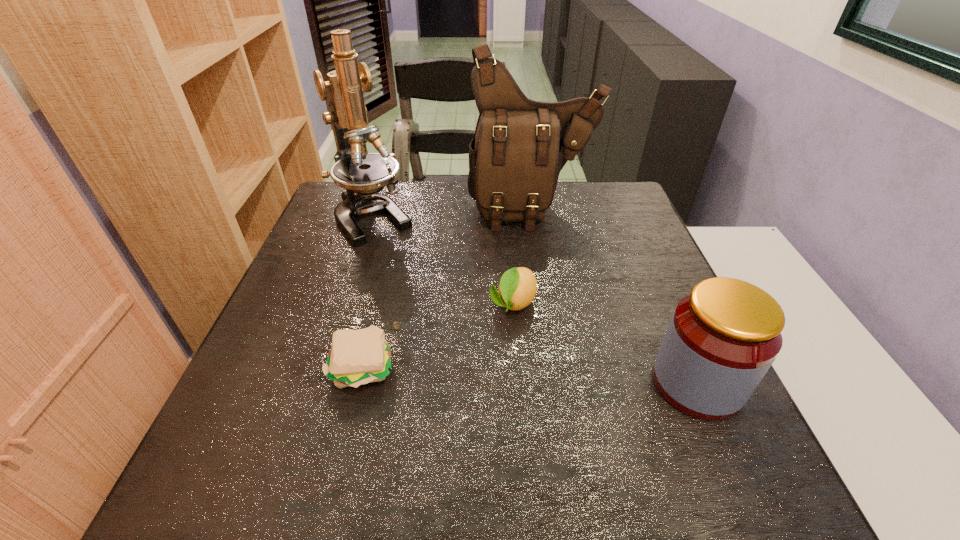
This screenshot has height=540, width=960. I want to click on free space between the microscope and the patty, so click(368, 293).

Find the location of a particular element. This screenshot has width=960, height=540. vacant space that's between the microscope and the lemon is located at coordinates (443, 261).

Locate an element on the screen. The height and width of the screenshot is (540, 960). free space between the shoulder bag and the jar is located at coordinates (614, 297).

The height and width of the screenshot is (540, 960). Find the location of `empty location between the microscope and the second tallest object`. empty location between the microscope and the second tallest object is located at coordinates (453, 214).

In order to click on free space between the shortest object and the microscope in this screenshot , I will do `click(368, 293)`.

Locate an element on the screen. The height and width of the screenshot is (540, 960). object identified as the third closest to the lemon is located at coordinates (723, 337).

Where is `the third closest object to the microscope`? The height and width of the screenshot is (540, 960). the third closest object to the microscope is located at coordinates (357, 357).

I want to click on free spot that satisfies the following two spatial constraints: 1. on the back side of the shoulder bag; 2. on the right side of the lemon, so click(x=505, y=211).

The image size is (960, 540). I want to click on free spot that satisfies the following two spatial constraints: 1. on the front side of the shoulder bag; 2. on the left side of the jar, so [x=561, y=383].

You are a GUI agent. You are given a task and a screenshot of the screen. Output one action in this format:
    pyautogui.click(x=<x>, y=<y>)
    Task: Click on the vacant space that satisfies the following two spatial constraints: 1. on the front side of the third shortest object; 2. on the left side of the shoulder bag
    
    Given the screenshot: What is the action you would take?
    pyautogui.click(x=561, y=383)